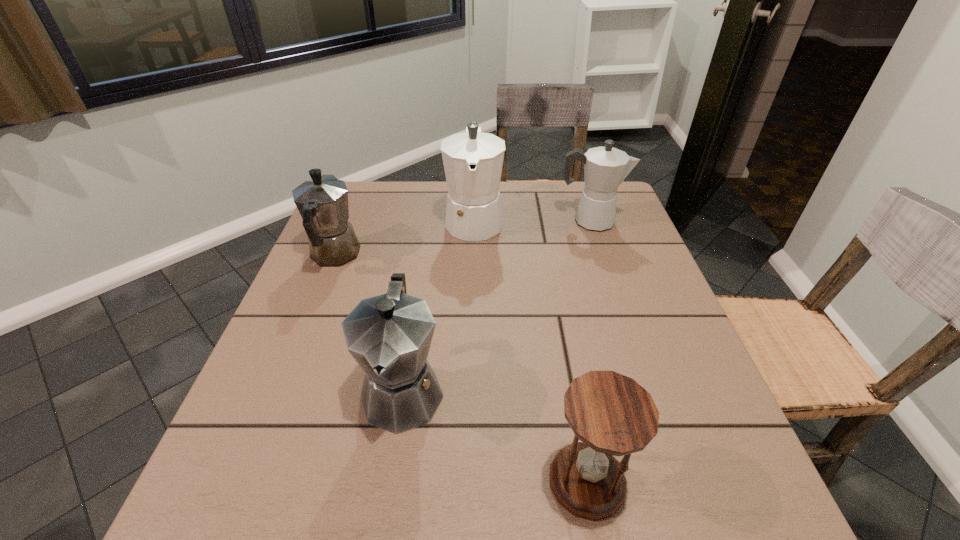
Where is `vacant space at the right edge`? Image resolution: width=960 pixels, height=540 pixels. vacant space at the right edge is located at coordinates (670, 393).

At what (x,y) coordinates should I click in order to perform the action: click on free space at the far left corner. Please return your answer as a coordinate pair (x, y). The width and height of the screenshot is (960, 540). Looking at the image, I should click on (359, 205).

Image resolution: width=960 pixels, height=540 pixels. In order to click on vacant area at the far right corner in this screenshot , I will do `click(617, 193)`.

The image size is (960, 540). Identify the location of vacant area that lies between the leftmost object and the nearest object. (461, 368).

The width and height of the screenshot is (960, 540). In order to click on empty location between the nearest object and the leftmost coffeepot in this screenshot , I will do [x=461, y=368].

The image size is (960, 540). In order to click on blank region between the second nearest object and the hourglass in this screenshot , I will do point(495,436).

Identify the location of vacant space that's between the nearest coffeepot and the shortest object. The height and width of the screenshot is (540, 960). (495, 436).

Locate an element on the screen. free space between the leftmost coffeepot and the tallest object is located at coordinates [x=404, y=238].

At what (x,y) coordinates should I click in order to perform the action: click on vacant area between the hourglass and the rightmost coffeepot. Please return your answer as a coordinate pair (x, y). This screenshot has height=540, width=960. Looking at the image, I should click on (588, 351).

Locate an element on the screen. The width and height of the screenshot is (960, 540). empty location between the nearest coffeepot and the tallest coffeepot is located at coordinates (439, 305).